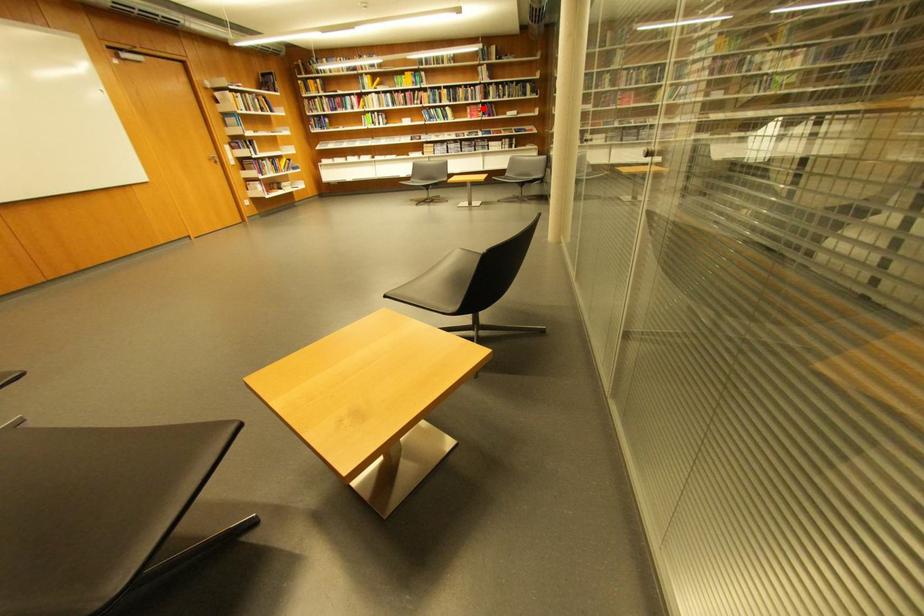
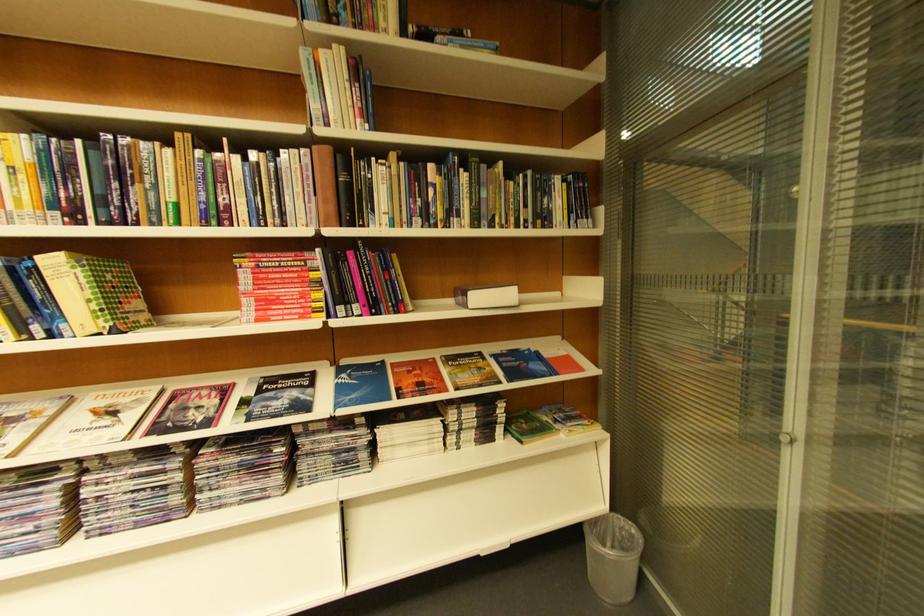
Question: I am providing you with two images of the same scene from different viewpoints. A red point is shown in image1. For the corresponding object point in image2, is it positioned nearer or farther from the camera?

Choices:
 (A) Nearer
 (B) Farther

Answer: (B)